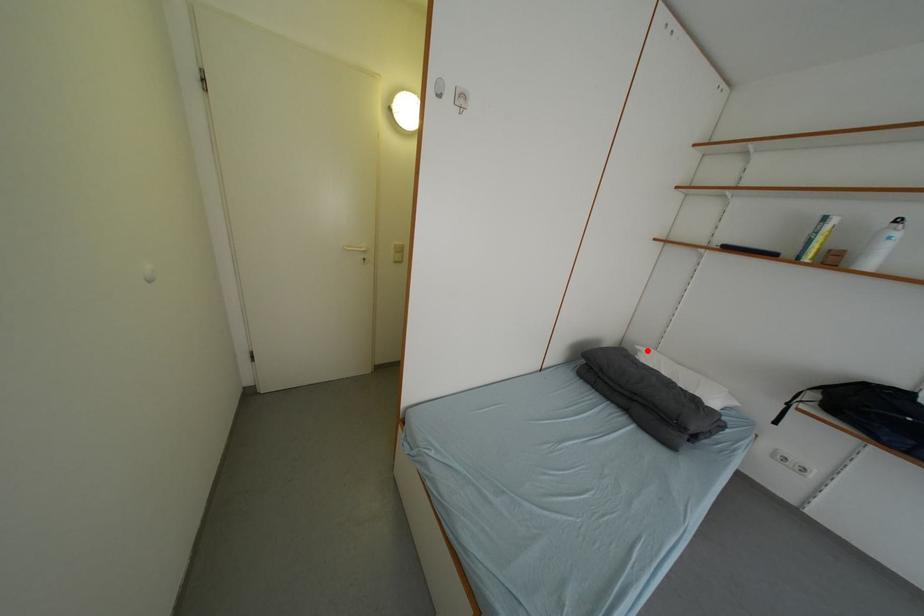
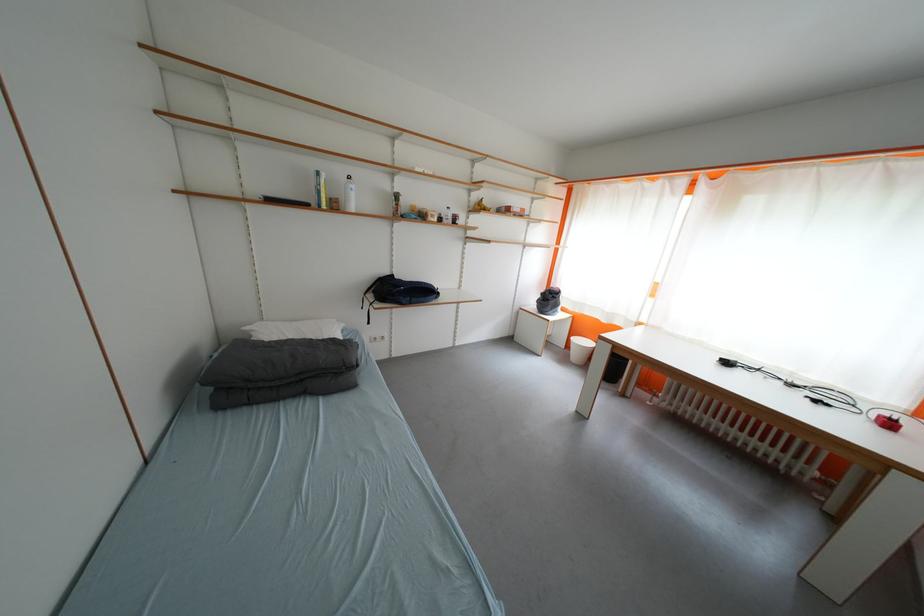
Where in the second image is the point corresponding to the highlighted location from the first image?

(257, 331)